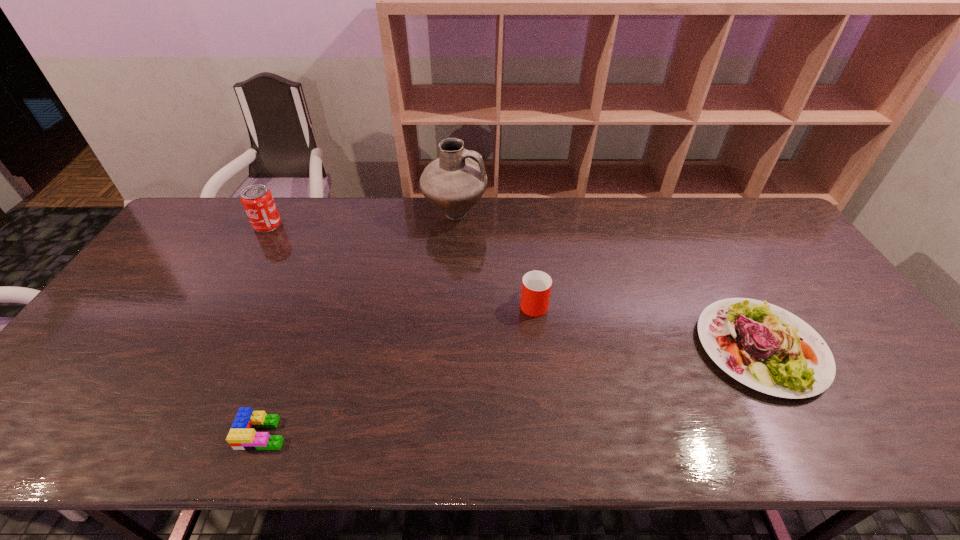
Locate an element on the screen. This screenshot has height=540, width=960. object that is at the right edge is located at coordinates (765, 347).

The image size is (960, 540). I want to click on vacant space at the far edge of the desktop, so click(450, 219).

Where is `vacant space at the near edge of the desktop`? The image size is (960, 540). vacant space at the near edge of the desktop is located at coordinates (717, 434).

At what (x,y) coordinates should I click in order to perform the action: click on free space at the left edge of the desktop. Please return your answer as a coordinate pair (x, y). This screenshot has height=540, width=960. Looking at the image, I should click on (186, 277).

Where is `vacant space in between the Lego and the can`? vacant space in between the Lego and the can is located at coordinates (265, 329).

Identify the location of vacant area that lies between the third object from right to left and the nearest object. (359, 325).

Image resolution: width=960 pixels, height=540 pixels. I want to click on free space between the second shortest object and the leftmost object, so click(x=515, y=286).

This screenshot has height=540, width=960. What are the coordinates of `free point between the shortest object and the tallest object` in the screenshot? It's located at (359, 325).

This screenshot has width=960, height=540. I want to click on blank region between the third object from left to right and the can, so click(x=361, y=220).

Where is `vacant space that's between the cup and the pitcher`? This screenshot has width=960, height=540. vacant space that's between the cup and the pitcher is located at coordinates (494, 259).